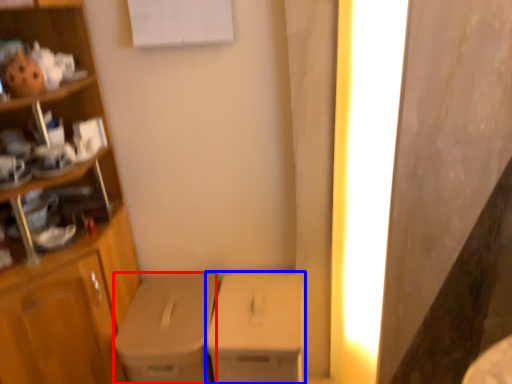
Question: Which point is further to the camera, cardboard box (highlighted by a red box) or cardboard box (highlighted by a blue box)?

Choices:
 (A) cardboard box
 (B) cardboard box

Answer: (A)